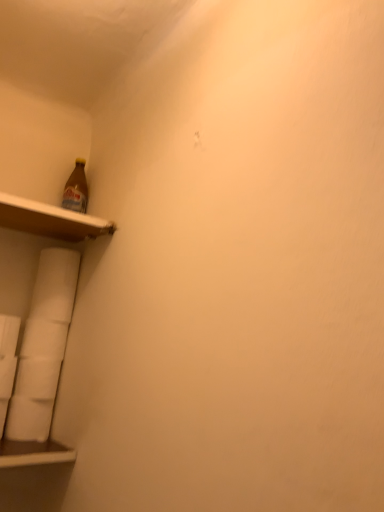
Question: Is wooden shelf at upper left to the right of white matte toilet paper at lower left, the 3th toilet paper when ordered from top to bottom, from the viewer's perspective?

Choices:
 (A) no
 (B) yes

Answer: (B)

Question: Considering the relative sizes of wooden shelf at upper left and white matte toilet paper at lower left, which is the 2th toilet paper from bottom to top, in the image provided, is wooden shelf at upper left bigger than white matte toilet paper at lower left, which is the 2th toilet paper from bottom to top,?

Choices:
 (A) no
 (B) yes

Answer: (B)

Question: Is wooden shelf at upper left in front of white matte toilet paper at lower left, which is the 2th toilet paper from bottom to top?

Choices:
 (A) yes
 (B) no

Answer: (A)

Question: Can you confirm if wooden shelf at upper left is taller than white matte toilet paper at lower left, which is the 2th toilet paper from bottom to top?

Choices:
 (A) no
 (B) yes

Answer: (A)

Question: Is wooden shelf at upper left aimed at white matte toilet paper at lower left, which is the 2th toilet paper from bottom to top?

Choices:
 (A) yes
 (B) no

Answer: (B)

Question: Could white matte toilet paper at lower left, which is the 2th toilet paper from bottom to top, be considered to be inside wooden shelf at upper left?

Choices:
 (A) yes
 (B) no

Answer: (B)

Question: Could you tell me if wooden shelf at upper left is facing white matte toilet paper at lower left, placed as the 1th toilet paper when sorted from top to bottom?

Choices:
 (A) yes
 (B) no

Answer: (B)

Question: Is wooden shelf at upper left not close to white matte toilet paper at lower left, placed as the 1th toilet paper when sorted from top to bottom?

Choices:
 (A) yes
 (B) no

Answer: (B)

Question: Does wooden shelf at upper left have a lesser width compared to white matte toilet paper at lower left, placed as the 1th toilet paper when sorted from top to bottom?

Choices:
 (A) no
 (B) yes

Answer: (A)

Question: From the image's perspective, does wooden shelf at upper left appear higher than white matte toilet paper at lower left, the fourth toilet paper from the bottom?

Choices:
 (A) no
 (B) yes

Answer: (B)

Question: Can you confirm if wooden shelf at upper left is bigger than white matte toilet paper at lower left, the fourth toilet paper from the bottom?

Choices:
 (A) yes
 (B) no

Answer: (A)

Question: Can you confirm if wooden shelf at upper left is smaller than white matte toilet paper at lower left, placed as the 1th toilet paper when sorted from top to bottom?

Choices:
 (A) no
 (B) yes

Answer: (A)

Question: Is white matte toilet paper at lower left, the fourth toilet paper from the bottom, facing away from wooden shelf at upper left?

Choices:
 (A) no
 (B) yes

Answer: (A)